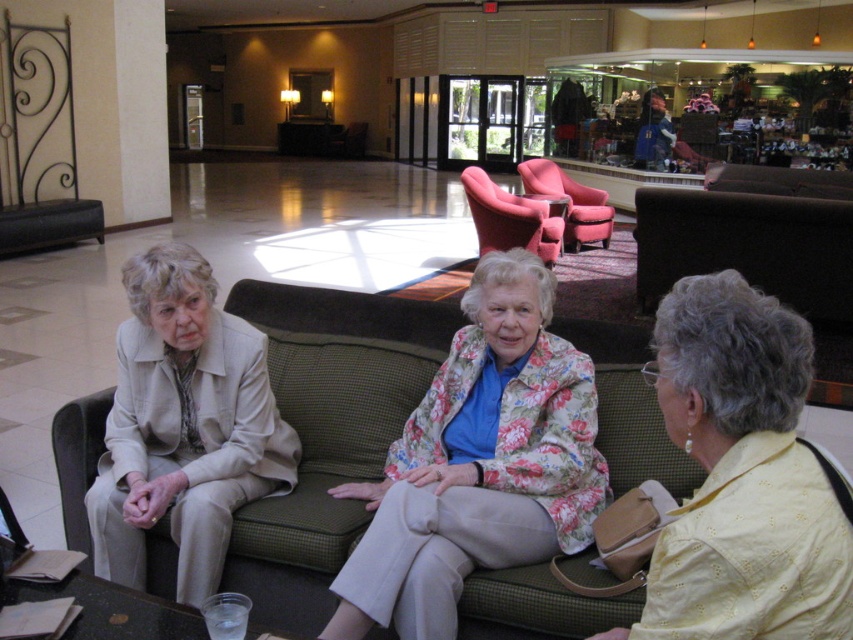
Consider the image. You are standing in the hotel lobby and want to walk from point A to point B. Point A is at coordinate point [242,572] and point B is at coordinate point [799,605]. Which point is closer to you when you start walking?

Point A at coordinate point [242,572] is closer to you than point B at coordinate point [799,605] because it is further to the viewer.